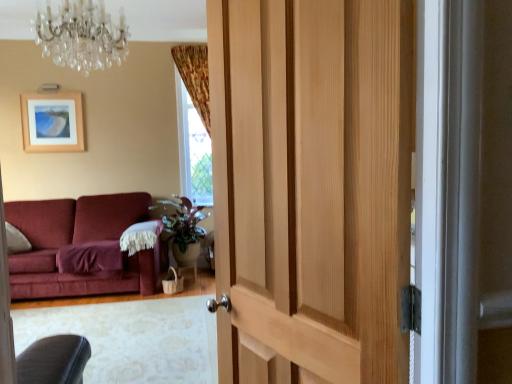
Question: Based on their sizes in the image, would you say natural wood door at center is bigger or smaller than green matte plant at center?

Choices:
 (A) small
 (B) big

Answer: (B)

Question: From a real-world perspective, is natural wood door at center positioned above or below green matte plant at center?

Choices:
 (A) above
 (B) below

Answer: (A)

Question: Estimate the real-world distances between objects in this image. Which object is closer to the green matte plant at center?

Choices:
 (A) crystal glass chandelier at upper center
 (B) wooden picture frame at upper left
 (C) natural wood door at center

Answer: (B)

Question: Which is nearer to the green matte plant at center?

Choices:
 (A) natural wood door at center
 (B) crystal glass chandelier at upper center
 (C) wooden picture frame at upper left

Answer: (C)